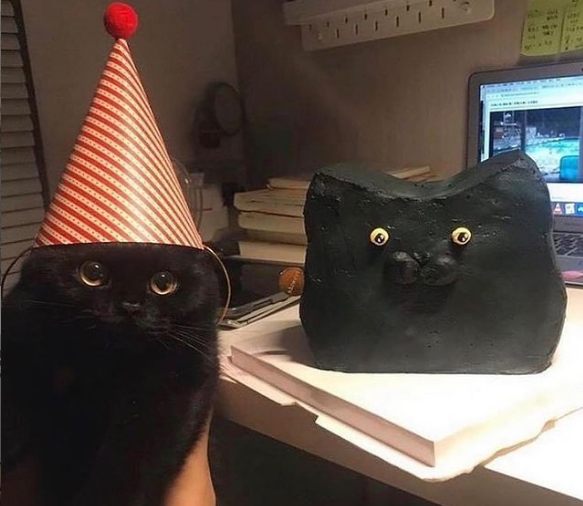
The image size is (583, 506). I want to click on cat statue's right eye, so [x=382, y=236].